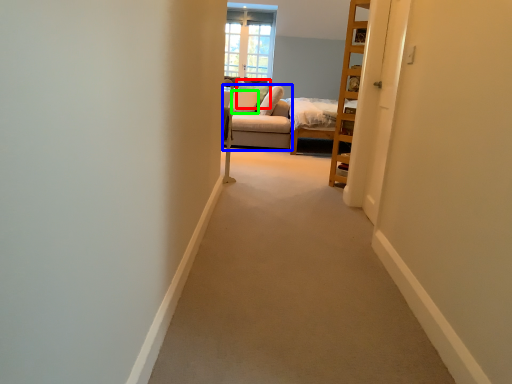
Question: Which object is the farthest from pillow (highlighted by a red box)? Choose among these: couch (highlighted by a blue box) or pillow (highlighted by a green box).

Choices:
 (A) couch
 (B) pillow

Answer: (A)